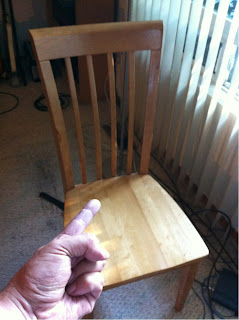
Image resolution: width=239 pixels, height=320 pixels. Identify the location of rungs. (84, 165), (70, 188), (98, 166), (113, 164), (130, 159), (143, 163).